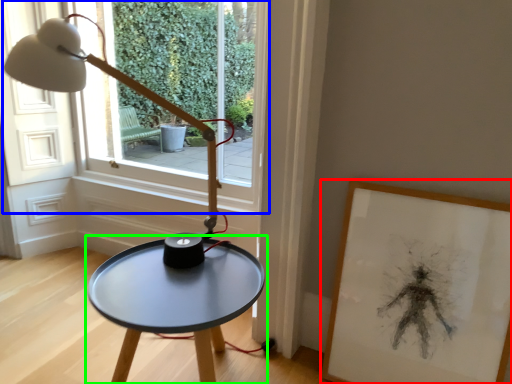
Question: Which is nearer to the picture frame (highlighted by a red box)? window (highlighted by a blue box) or table (highlighted by a green box).

Choices:
 (A) window
 (B) table

Answer: (B)